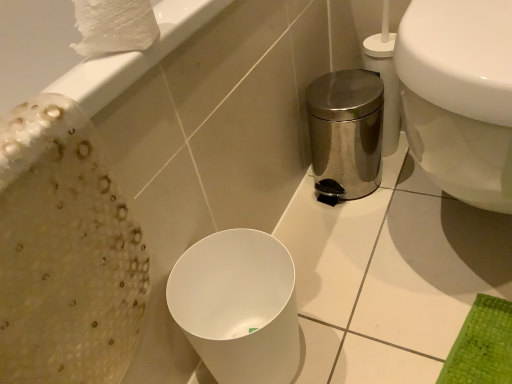
Question: From the image's perspective, is white matte bidet at center above or below white textured toilet paper at upper left?

Choices:
 (A) below
 (B) above

Answer: (A)

Question: Relative to white textured toilet paper at upper left, is white matte bidet at center in front or behind?

Choices:
 (A) behind
 (B) front

Answer: (A)

Question: Considering the real-world distances, which object is farthest from the white textured toilet paper at upper left?

Choices:
 (A) white matte bidet at center
 (B) white glossy toilet at right

Answer: (A)

Question: Which of these objects is positioned farthest from the white matte bidet at center?

Choices:
 (A) white textured toilet paper at upper left
 (B) white glossy toilet at right

Answer: (A)